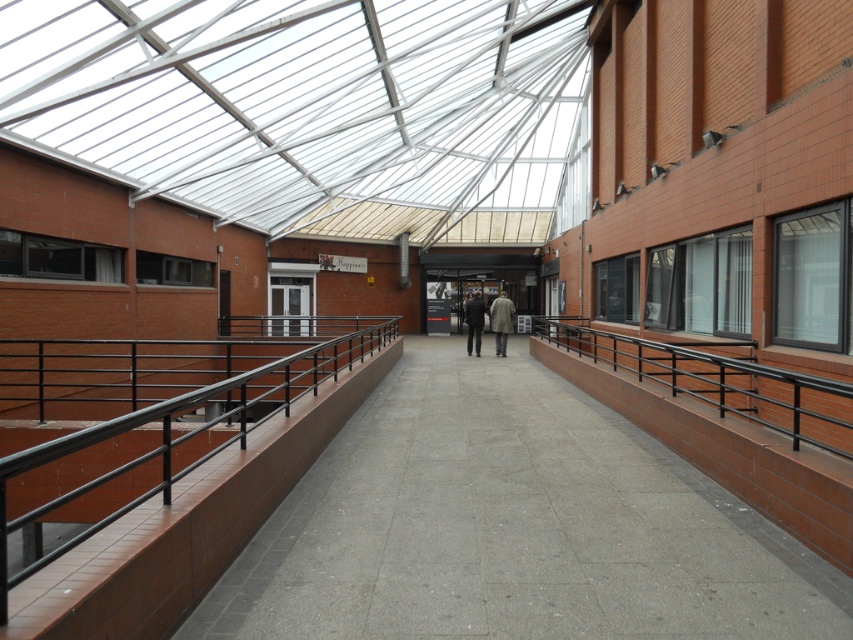
Who is more distant from viewer, [492,321] or [480,326]?

Positioned behind is point [492,321].

Which of these two, light brown textured coat at center or dark gray suit at center, stands shorter?

dark gray suit at center

What are the coordinates of `light brown textured coat at center` in the screenshot? It's located at (502, 321).

Can you confirm if black metal/rail at center is taller than black metal/rail at right?

Indeed, black metal/rail at center has a greater height compared to black metal/rail at right.

Is black metal/rail at center to the left of black metal/rail at right from the viewer's perspective?

Indeed, black metal/rail at center is positioned on the left side of black metal/rail at right.

Identify the location of black metal/rail at center. This screenshot has height=640, width=853. (184, 486).

Is black metal/rail at center positioned before dark gray suit at center?

Yes, black metal/rail at center is in front of dark gray suit at center.

Between black metal/rail at center and dark gray suit at center, which one is positioned higher?

dark gray suit at center is higher up.

Who is more distant from viewer, (32, 448) or (476, 317)?

Positioned behind is point (476, 317).

Where is `black metal/rail at center`? The height and width of the screenshot is (640, 853). black metal/rail at center is located at coordinates (184, 486).